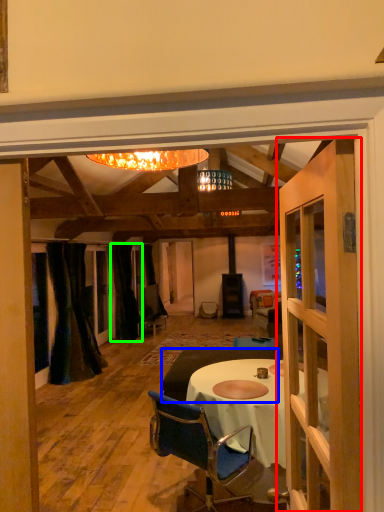
Question: Estimate the real-world distances between objects in this image. Which object is farther from door (highlighted by a red box), studio couch (highlighted by a blue box) or curtain (highlighted by a green box)?

Choices:
 (A) studio couch
 (B) curtain

Answer: (B)